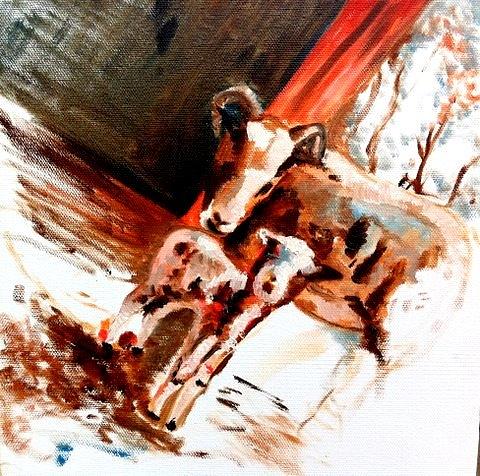
At what (x,y) coordinates should I click in order to perform the action: click on painting. Please return your answer as a coordinate pair (x, y). Looking at the image, I should click on (87, 209).